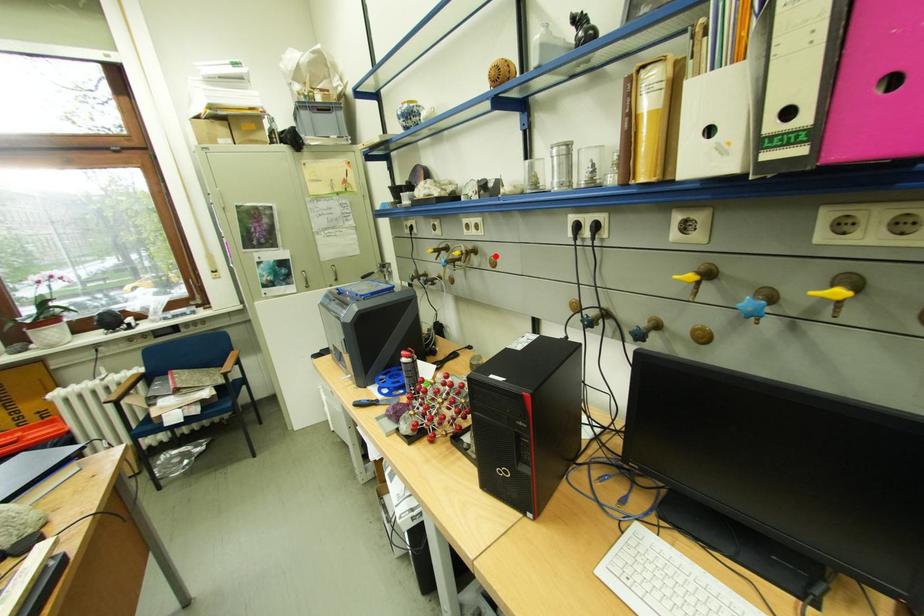
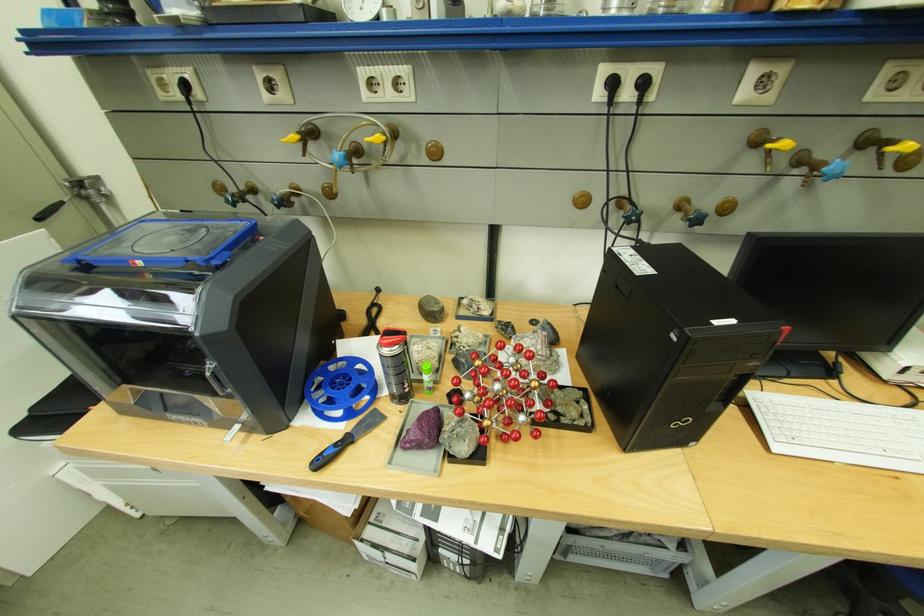
Locate, in the second image, the point that corresponds to the highlighted location in the first image.

(428, 140)